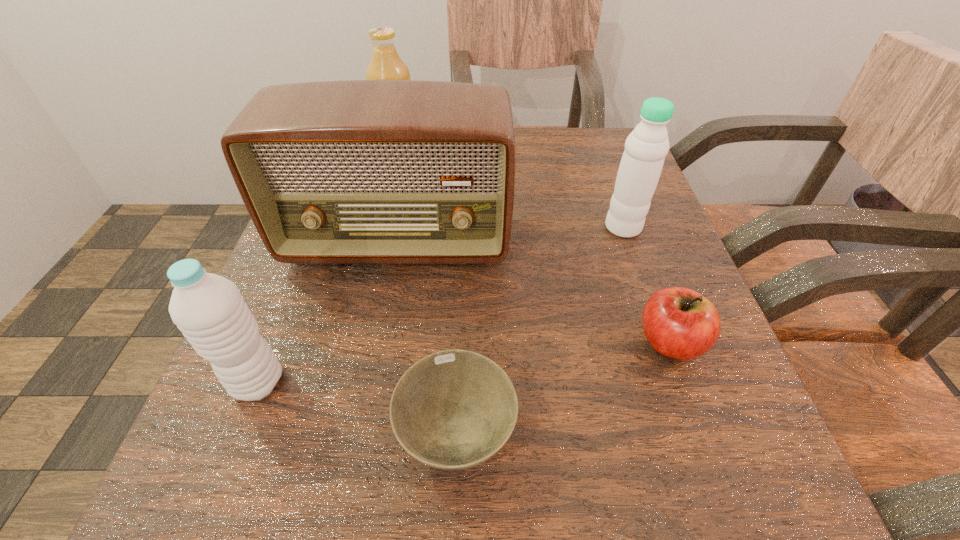
Image resolution: width=960 pixels, height=540 pixels. I want to click on the farthest object, so click(x=385, y=64).

The height and width of the screenshot is (540, 960). In order to click on radio receiver in this screenshot , I will do `click(359, 171)`.

This screenshot has width=960, height=540. I want to click on the farther water bottle, so click(x=640, y=168).

Find the location of `the nearer water bottle`. the nearer water bottle is located at coordinates (209, 310).

At what (x,y) coordinates should I click in order to perform the action: click on the fifth tallest object. Please return your answer as a coordinate pair (x, y). Image resolution: width=960 pixels, height=540 pixels. Looking at the image, I should click on (680, 323).

At what (x,y) coordinates should I click in order to perform the action: click on the shortest object. Please return your answer as a coordinate pair (x, y). This screenshot has height=540, width=960. Looking at the image, I should click on (454, 409).

Locate an element on the screen. This screenshot has width=960, height=540. free space located on the label of the farthest object is located at coordinates (452, 158).

Identify the location of vacant space located on the front-facing side of the radio receiver. (383, 319).

The width and height of the screenshot is (960, 540). In order to click on blank space located 0.190m on the left of the farther water bottle in this screenshot , I will do `click(498, 227)`.

The width and height of the screenshot is (960, 540). Identify the location of free space located 0.310m on the right of the left water bottle. (524, 382).